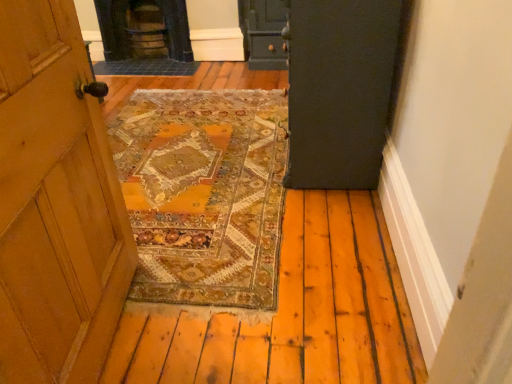
Question: Is matte dark green door at center-right touching dark brown stone stove at upper center?

Choices:
 (A) yes
 (B) no

Answer: (B)

Question: From the image's perspective, would you say matte dark green door at center-right is positioned over dark brown stone stove at upper center?

Choices:
 (A) yes
 (B) no

Answer: (B)

Question: Is matte dark green door at center-right further to the viewer compared to dark brown stone stove at upper center?

Choices:
 (A) no
 (B) yes

Answer: (A)

Question: Is dark brown stone stove at upper center at the back of matte dark green door at center-right?

Choices:
 (A) yes
 (B) no

Answer: (B)

Question: Considering the relative sizes of matte dark green door at center-right and dark brown stone stove at upper center in the image provided, is matte dark green door at center-right shorter than dark brown stone stove at upper center?

Choices:
 (A) no
 (B) yes

Answer: (A)

Question: From the image's perspective, does matte dark green door at center-right appear lower than dark brown stone stove at upper center?

Choices:
 (A) yes
 (B) no

Answer: (A)

Question: Could you tell me if dark brown stone stove at upper center is facing matte dark green door at center-right?

Choices:
 (A) no
 (B) yes

Answer: (A)

Question: Can you confirm if dark brown stone stove at upper center is bigger than matte dark green door at center-right?

Choices:
 (A) yes
 (B) no

Answer: (B)

Question: Does dark brown stone stove at upper center have a greater height compared to matte dark green door at center-right?

Choices:
 (A) no
 (B) yes

Answer: (A)

Question: Would you say dark brown stone stove at upper center is outside matte dark green door at center-right?

Choices:
 (A) no
 (B) yes

Answer: (B)

Question: Considering the relative sizes of dark brown stone stove at upper center and matte dark green door at center-right in the image provided, is dark brown stone stove at upper center wider than matte dark green door at center-right?

Choices:
 (A) yes
 (B) no

Answer: (B)

Question: Does dark brown stone stove at upper center have a smaller size compared to matte dark green door at center-right?

Choices:
 (A) no
 (B) yes

Answer: (B)

Question: Based on their sizes in the image, would you say dark brown stone stove at upper center is bigger or smaller than matte dark green door at center-right?

Choices:
 (A) big
 (B) small

Answer: (B)